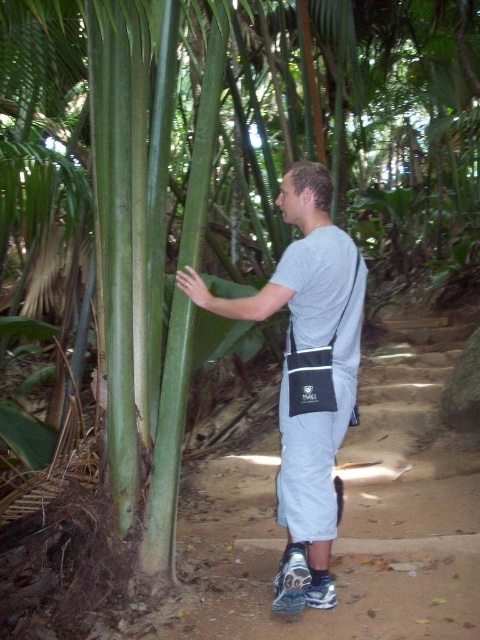
Can you confirm if gray fabric shirt at center is shorter than gray fabric bag at center?

Incorrect, gray fabric shirt at center's height does not fall short of gray fabric bag at center's.

From the picture: Can you confirm if gray fabric shirt at center is wider than gray fabric bag at center?

Correct, the width of gray fabric shirt at center exceeds that of gray fabric bag at center.

This screenshot has height=640, width=480. What do you see at coordinates (307, 374) in the screenshot?
I see `gray fabric shirt at center` at bounding box center [307, 374].

Identify the location of gray fabric shirt at center. (307, 374).